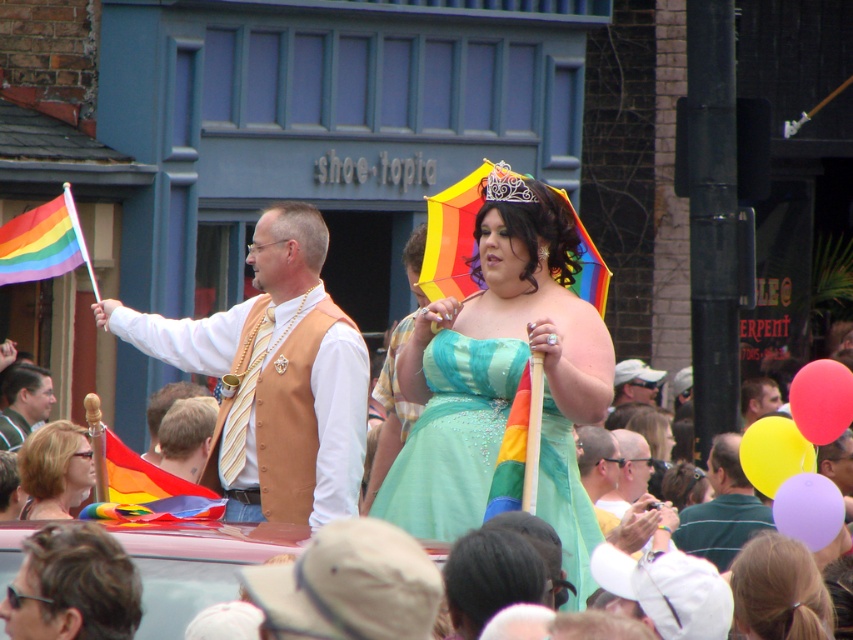
You are attending a parade and want to take a photo of the matte gold vest at center and the dark brown hair at lower left. Which object should you focus on first if you want to capture both in a single frame without moving the camera?

You should focus on the matte gold vest at center first because it is taller than the dark brown hair at lower left, allowing it to be more prominently featured while still fitting the smaller object into the frame.

You are a photographer at the parade. You want to take a photo that includes both the matte gold vest at center and the dark brown hair at lower left. Which object should you focus on first to ensure both are in frame?

You should focus on the matte gold vest at center first because it is positioned over the dark brown hair at lower left, so keeping the vest centered will naturally include the dark brown hair at lower left in the frame.